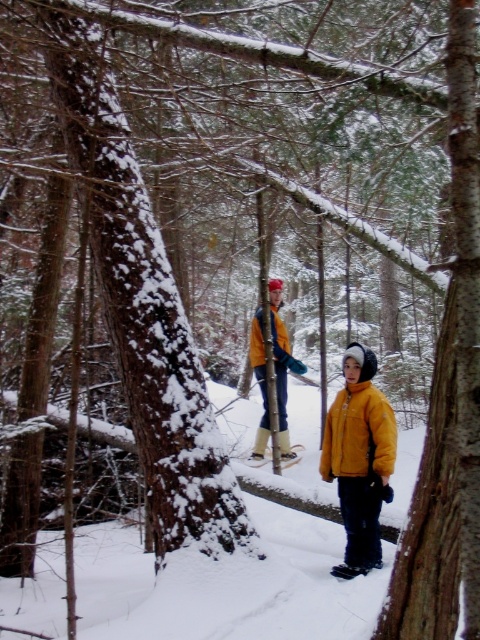
Question: Does matte yellow jacket at center have a larger size compared to yellow fuzzy jacket at lower center?

Choices:
 (A) yes
 (B) no

Answer: (A)

Question: Does matte yellow jacket at center have a smaller size compared to yellow fuzzy jacket at lower center?

Choices:
 (A) yes
 (B) no

Answer: (B)

Question: From the image, what is the correct spatial relationship of matte yellow jacket at center in relation to blue fleece jacket at center?

Choices:
 (A) right
 (B) left

Answer: (A)

Question: Which point is closer to the camera taking this photo?

Choices:
 (A) (331, 404)
 (B) (367, 460)
 (C) (283, 358)
 (D) (292, 451)

Answer: (B)

Question: Considering the real-world distances, which object is farthest from the matte yellow jacket at center?

Choices:
 (A) yellow matte jacket at center
 (B) yellow fuzzy jacket at lower center
 (C) blue fleece jacket at center

Answer: (C)

Question: Which of these objects is positioned closest to the yellow fuzzy jacket at lower center?

Choices:
 (A) yellow matte jacket at center
 (B) blue fleece jacket at center

Answer: (A)